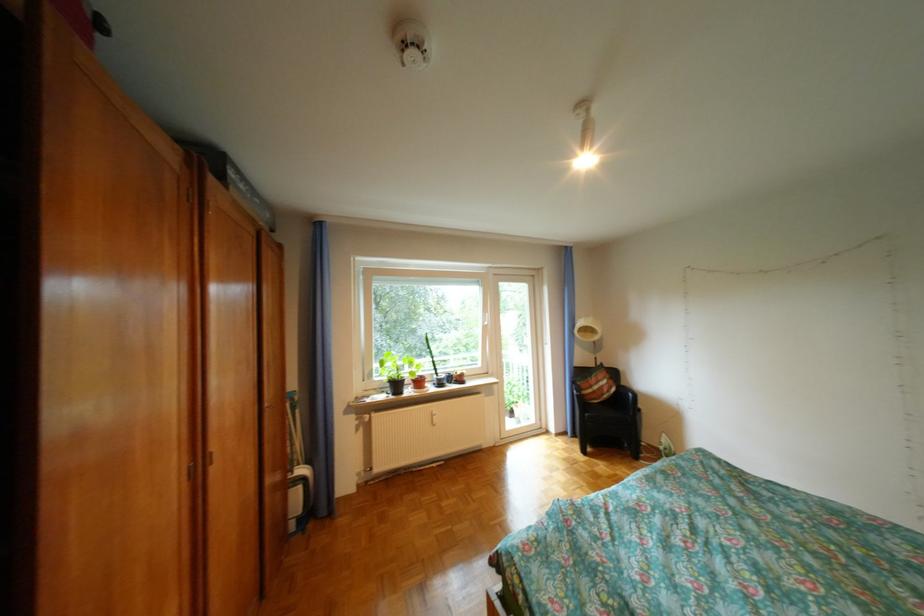
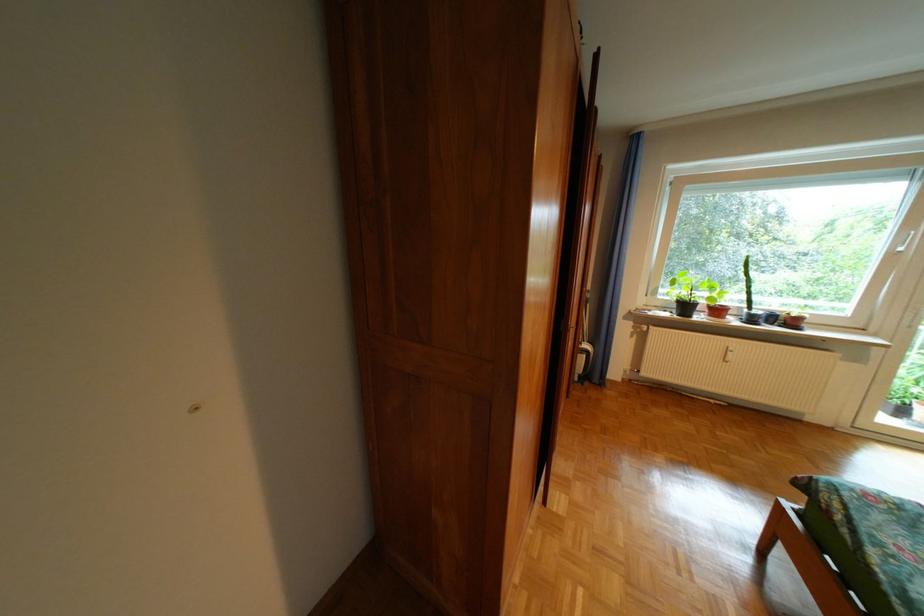
Locate, in the second image, the point that corresponds to (396,398) in the first image.

(679, 315)